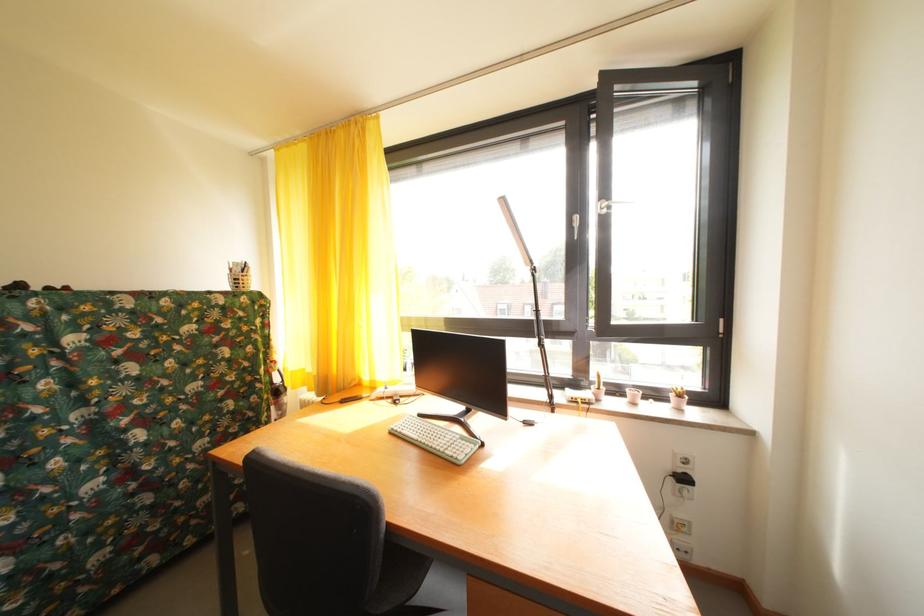
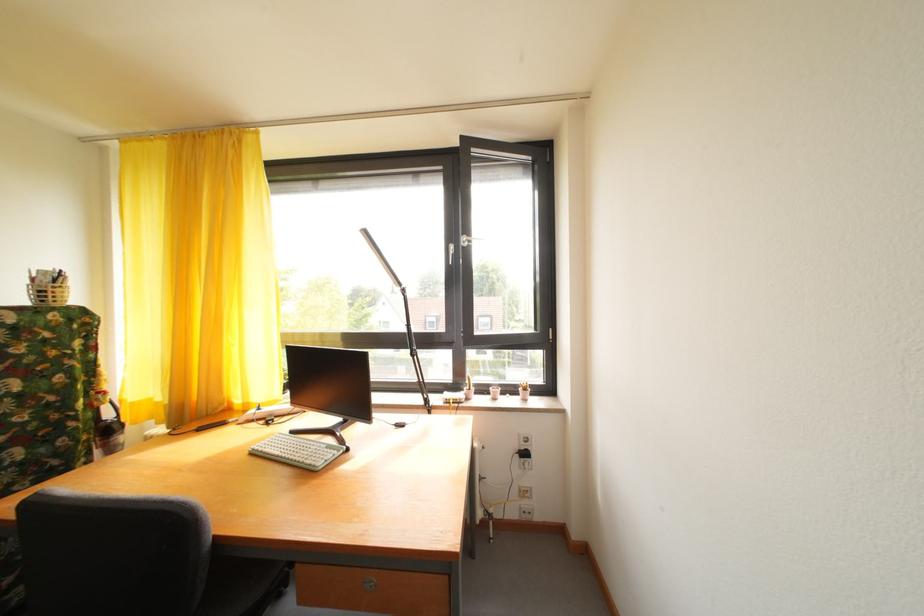
The point at (x=429, y=421) is marked in the first image. Where is the corresponding point in the second image?

(301, 438)